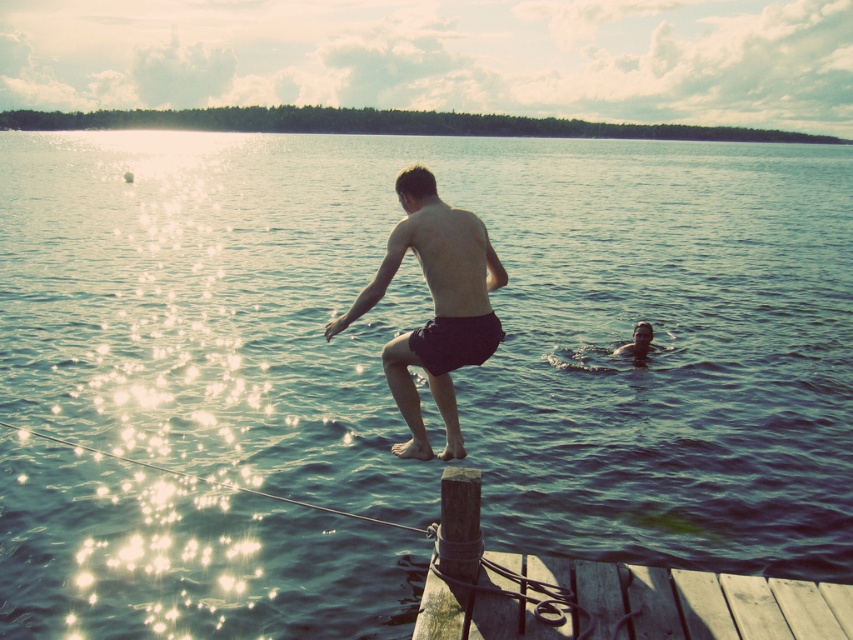
Can you confirm if wooden planks at lower right is positioned to the left of black matte shorts at center?

Incorrect, wooden planks at lower right is not on the left side of black matte shorts at center.

From the picture: Is the position of wooden planks at lower right more distant than that of black matte shorts at center?

No, it is in front of black matte shorts at center.

Identify the location of wooden planks at lower right. click(x=607, y=593).

At what (x,y) coordinates should I click in order to perform the action: click on wooden planks at lower right. Please return your answer as a coordinate pair (x, y). Looking at the image, I should click on (607, 593).

Can you confirm if black matte shorts at center is bigger than smooth skin boy at lower right?

Indeed, black matte shorts at center has a larger size compared to smooth skin boy at lower right.

Who is lower down, black matte shorts at center or smooth skin boy at lower right?

smooth skin boy at lower right

The image size is (853, 640). What do you see at coordinates (434, 307) in the screenshot?
I see `black matte shorts at center` at bounding box center [434, 307].

Locate an element on the screen. The width and height of the screenshot is (853, 640). black matte shorts at center is located at coordinates (434, 307).

Which of these two, wooden planks at lower right or smooth skin boy at lower right, stands shorter?

With less height is smooth skin boy at lower right.

Is point (579, 595) behind point (641, 337)?

No, it is not.

This screenshot has height=640, width=853. Identify the location of wooden planks at lower right. (607, 593).